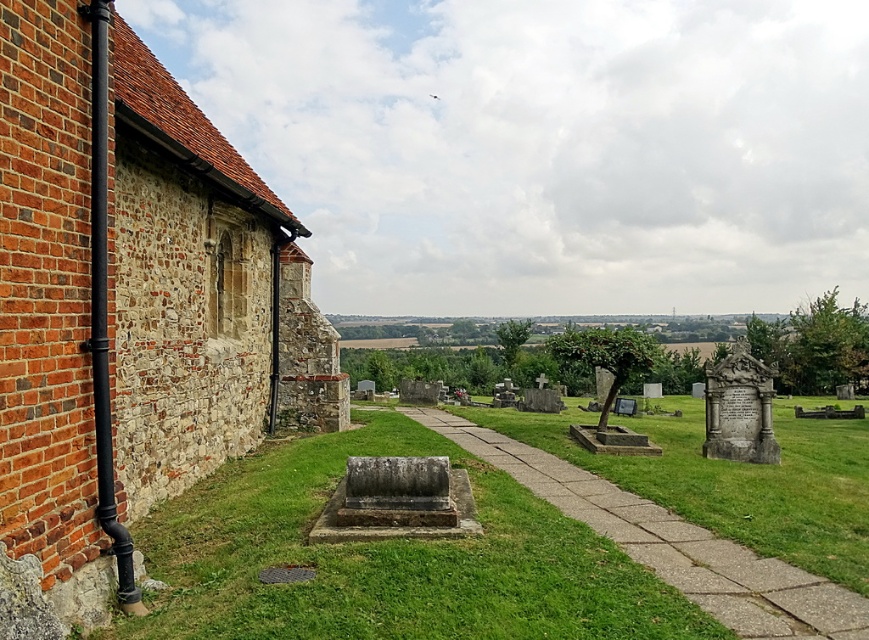
You are a gardener planning to mow the lawn. You see the green grass at center and the concrete paving at center. Which area should you avoid mowing?

You should avoid mowing the concrete paving at center because it is to the right of green grass at center and made of concrete, which cannot be mowed.

You are a gardener planning to mow the lawn. You see the green grass at center and the concrete paving at center. Which area should you avoid mowing to prevent damaging the concrete?

You should avoid mowing the concrete paving at center because it is behind the green grass at center and is not part of the lawn area.